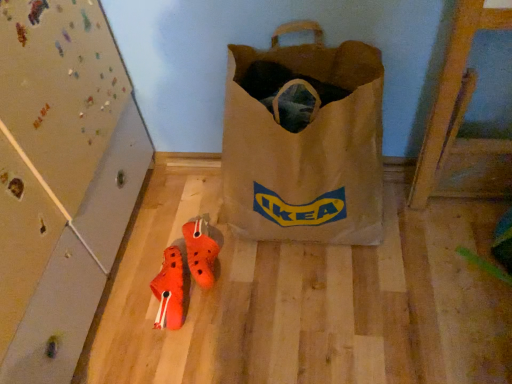
This screenshot has width=512, height=384. I want to click on free space to the left of orange rubber clogs at center, the 2th footwear from the left, so click(133, 276).